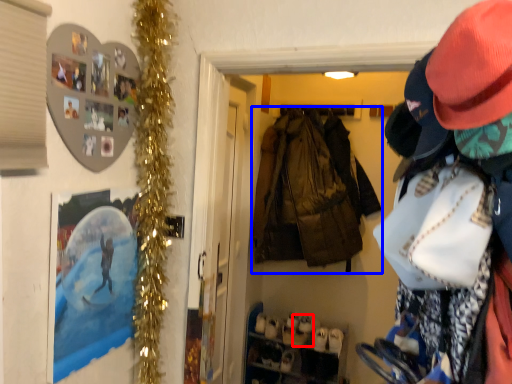
Question: Which object appears closest to the camera in this image, shoe (highlighted by a red box) or jacket (highlighted by a blue box)?

Choices:
 (A) shoe
 (B) jacket

Answer: (B)